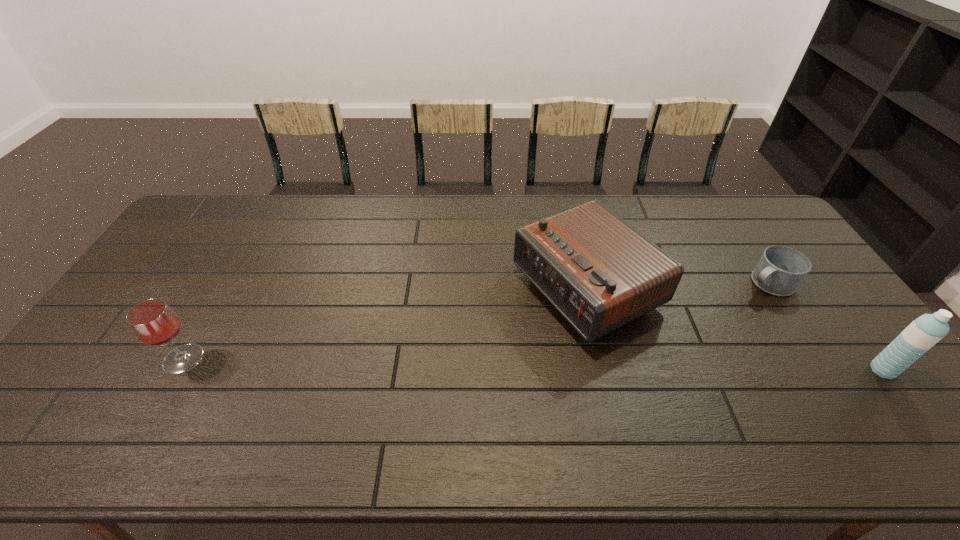
Locate an element on the screen. The image size is (960, 540). free space on the desktop that is between the leftmost object and the water bottle and is positioned on the side of the mug with the handle is located at coordinates (621, 366).

At what (x,y) coordinates should I click in order to perform the action: click on free spot on the desktop that is between the wineglass and the water bottle and is positioned on the tuning display of the third object from right to left. Please return your answer as a coordinate pair (x, y). The width and height of the screenshot is (960, 540). Looking at the image, I should click on (430, 363).